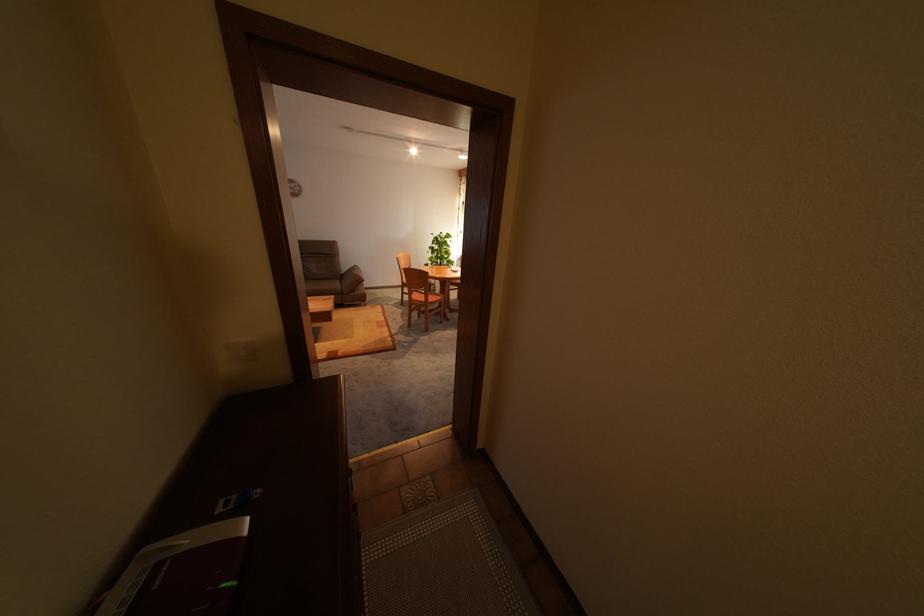
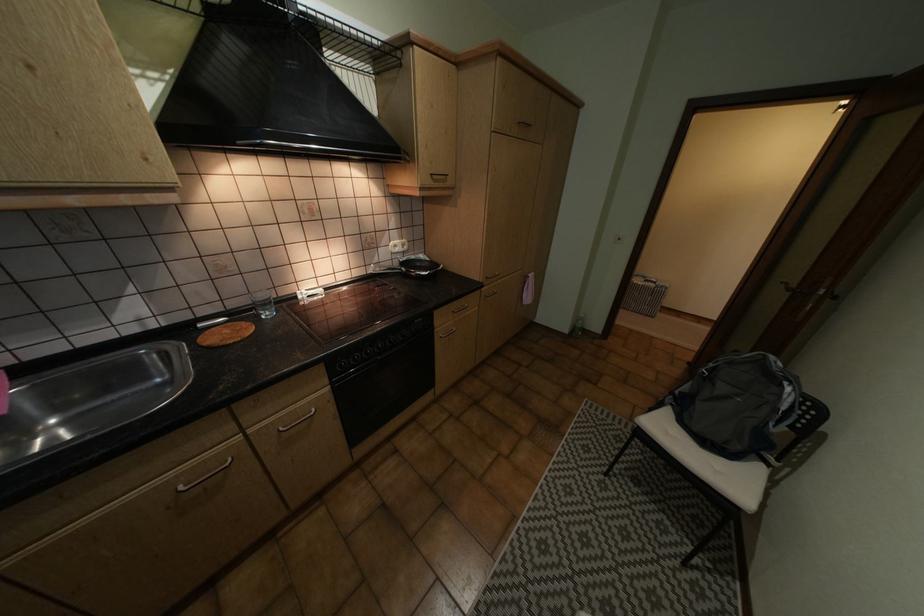
In a continuous first-person perspective shot, in which direction is the camera moving?

The cameraman walked toward left, backward.